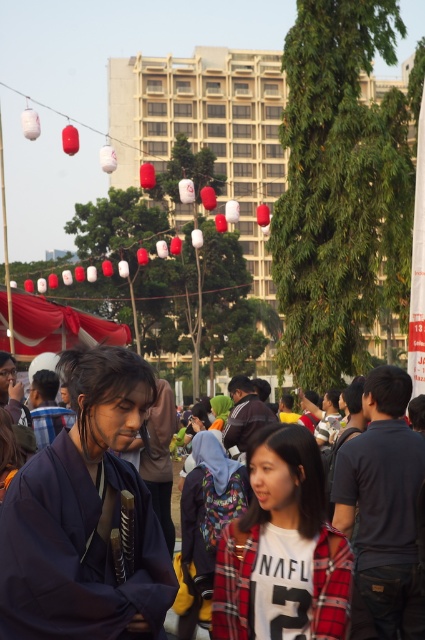
Can you confirm if white cotton shirt at center is positioned to the right of red fabric canopy at center?

Yes, white cotton shirt at center is to the right of red fabric canopy at center.

Does white cotton shirt at center have a smaller size compared to red fabric canopy at center?

Correct, white cotton shirt at center occupies less space than red fabric canopy at center.

Locate an element on the screen. The image size is (425, 640). white cotton shirt at center is located at coordinates (286, 529).

Does purple fabric kimono at center have a smaller size compared to plaid fabric jacket at center?

Yes.

Locate an element on the screen. This screenshot has height=640, width=425. purple fabric kimono at center is located at coordinates 85,516.

Is plaid fabric jacket at center above white cotton shirt at center?

Correct, plaid fabric jacket at center is located above white cotton shirt at center.

Can you confirm if plaid fabric jacket at center is positioned to the left of white cotton shirt at center?

Indeed, plaid fabric jacket at center is positioned on the left side of white cotton shirt at center.

Where is `plaid fabric jacket at center`? plaid fabric jacket at center is located at coordinates (85, 516).

Where is `plaid fabric jacket at center`? plaid fabric jacket at center is located at coordinates (85, 516).